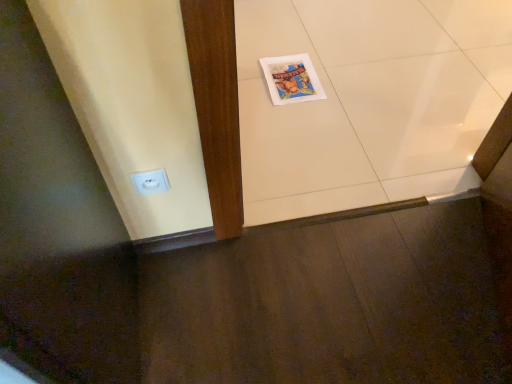
Where is `unoccupied area behind matte paper comic book at center`? Image resolution: width=512 pixels, height=384 pixels. unoccupied area behind matte paper comic book at center is located at coordinates (291, 43).